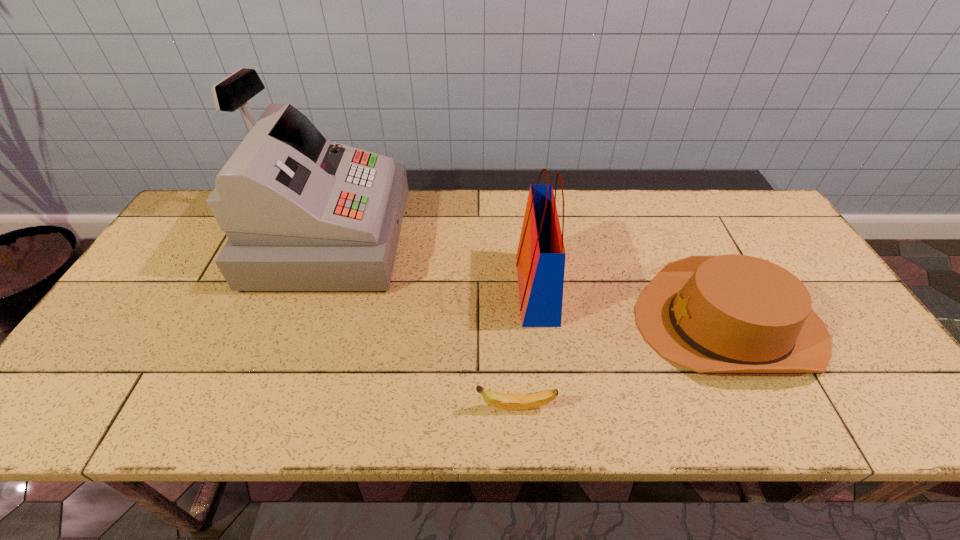
I want to click on vacant area between the cash register and the nearest object, so click(x=422, y=322).

Where is `the second closest object to the shopping bag`? This screenshot has height=540, width=960. the second closest object to the shopping bag is located at coordinates (504, 401).

Choose which object is the third nearest neighbor to the shortest object. Please provide its 2D coordinates. Your answer should be formatted as a tuple, i.e. [(x, y)], where the tuple contains the x and y coordinates of a point satisfying the conditions above.

[(302, 213)]